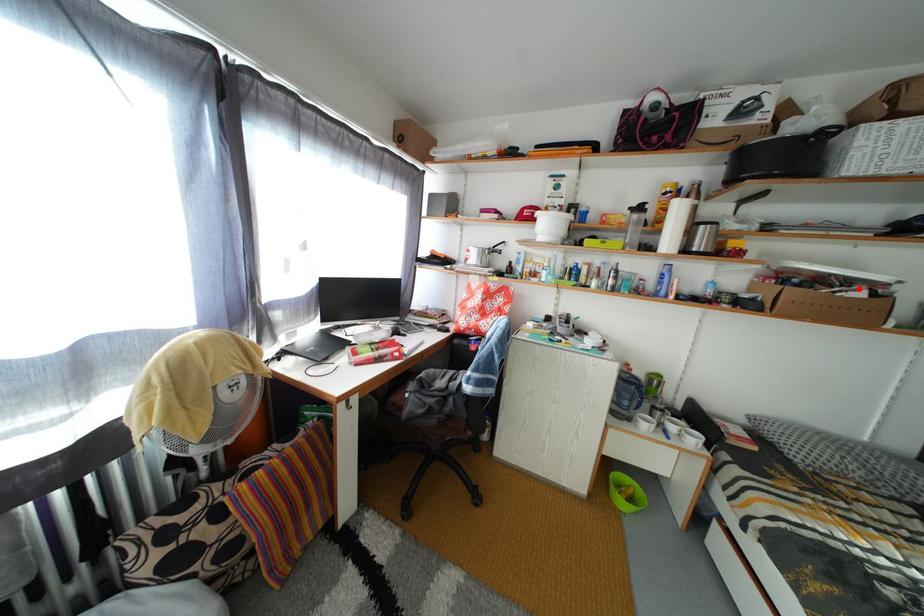
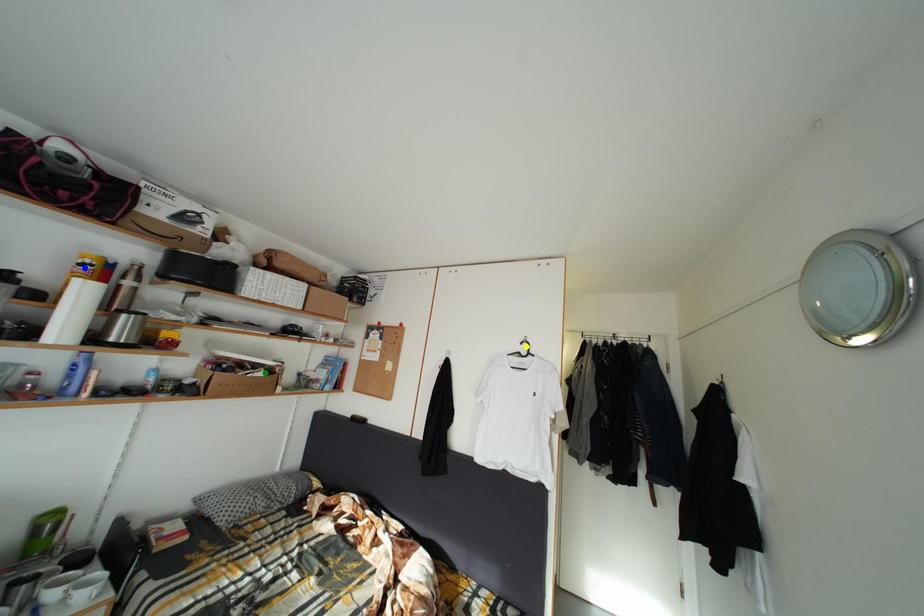
Question: I am providing you with two images of the same scene from different viewpoints. A red point is marked on the first image. You are given multiple points on the second image. Which point in image 2 represents the same 3d spot as the red point in image 1?

Choices:
 (A) blue point
 (B) yellow point
 (C) green point

Answer: (C)